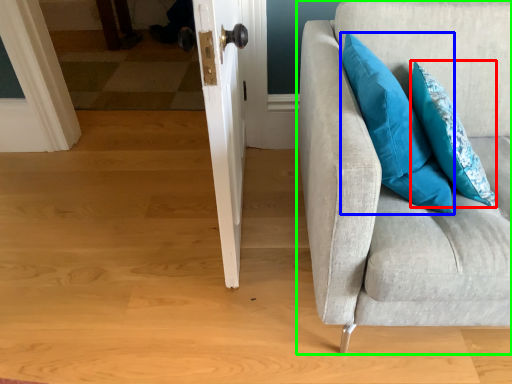
Question: Based on their relative distances, which object is farther from pillow (highlighted by a red box)? Choose from pillow (highlighted by a blue box) and studio couch (highlighted by a green box).

Choices:
 (A) pillow
 (B) studio couch

Answer: (B)